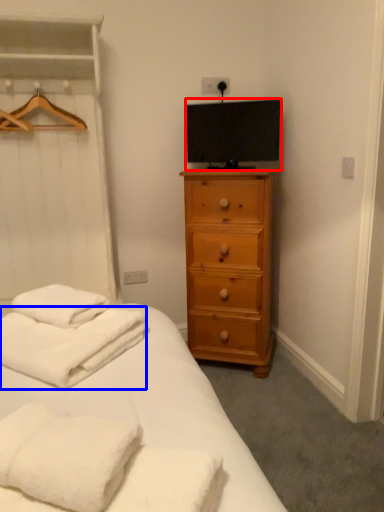
Question: Which object appears farthest to the camera in this image, television (highlighted by a red box) or bath towel (highlighted by a blue box)?

Choices:
 (A) television
 (B) bath towel

Answer: (A)